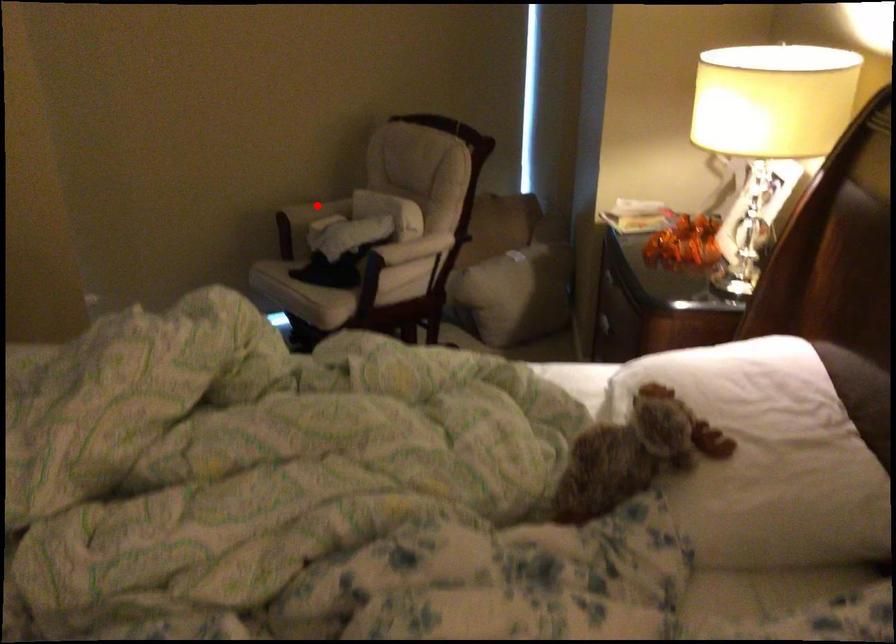
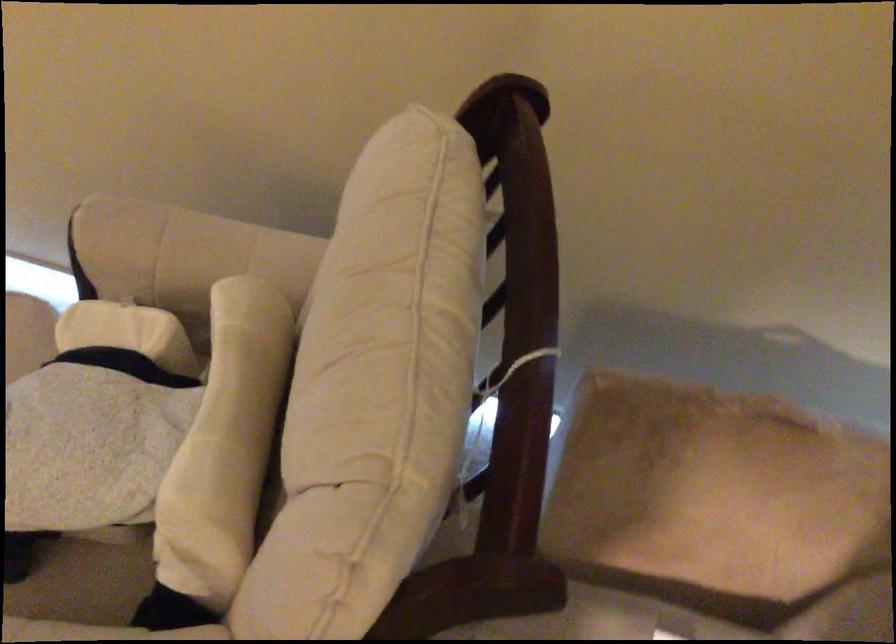
Locate, in the second image, the point that corresponds to the highlighted location in the first image.

(181, 250)